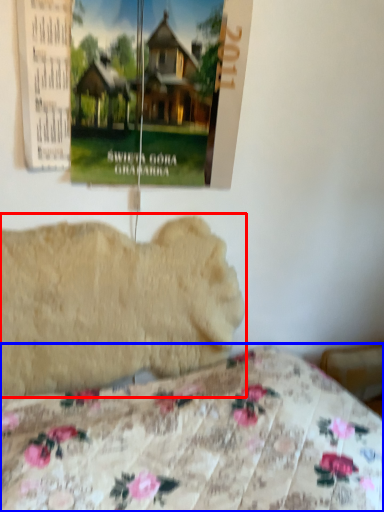
Question: Which object is closer to the camera taking this photo, animal (highlighted by a red box) or bed (highlighted by a blue box)?

Choices:
 (A) animal
 (B) bed

Answer: (B)